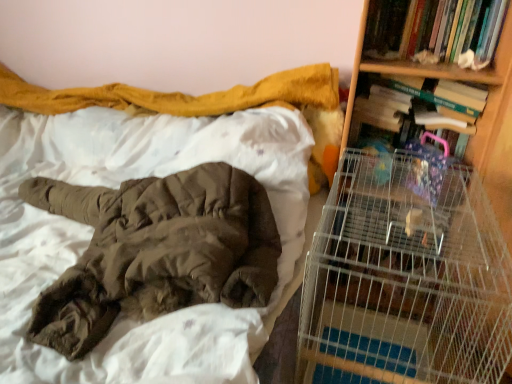
Locate an element on the screen. vacant space situated above metal wire cage at right (from a real-world perspective) is located at coordinates (393, 183).